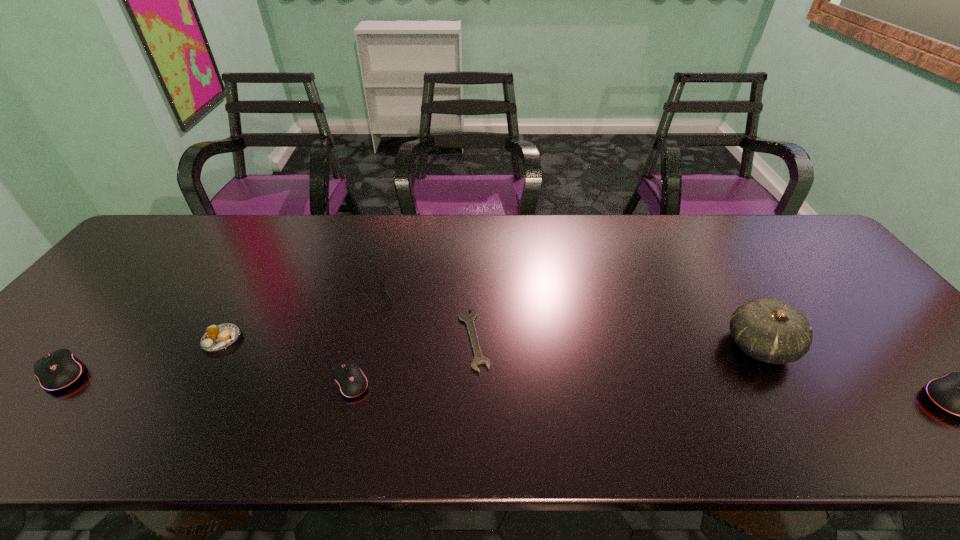
I want to click on vacant space located 0.080m on the back of the second tallest computer mouse, so click(101, 328).

What are the coordinates of `vacant space positioned on the right of the second computer mouse from left to right` in the screenshot? It's located at (520, 381).

Locate an element on the screen. This screenshot has width=960, height=540. vacant position located on the back of the sixth tallest object is located at coordinates (246, 298).

Find the location of a particular element. This screenshot has width=960, height=540. vacant area located on the right of the shortest object is located at coordinates [526, 339].

I want to click on vacant region located with the lenses facing outward on the spectacles, so click(440, 293).

Where is `vacant space situated 0.310m on the back of the gourd`? vacant space situated 0.310m on the back of the gourd is located at coordinates (700, 246).

The image size is (960, 540). I want to click on object that is positioned at the left edge, so click(x=58, y=370).

You are a GUI agent. You are given a task and a screenshot of the screen. Output one action in this format:
    pyautogui.click(x=<x>, y=<y>)
    Task: Click on the object that is at the near left corner
    The width and height of the screenshot is (960, 540).
    Given the screenshot: What is the action you would take?
    pyautogui.click(x=58, y=370)

At what (x,y) coordinates should I click in order to perform the action: click on free space at the far edge. Please return your answer as a coordinate pair (x, y). Looking at the image, I should click on (631, 246).

The width and height of the screenshot is (960, 540). In the image, there is a desktop. Identify the location of vacant space at the near edge. (617, 395).